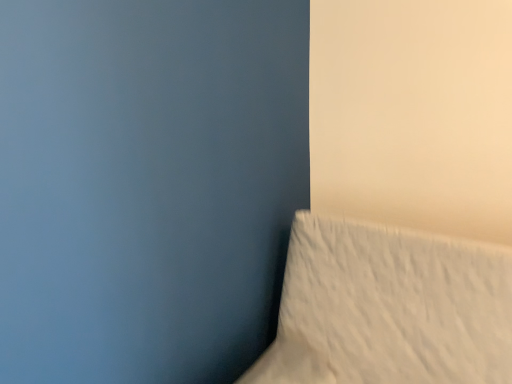
You are a GUI agent. You are given a task and a screenshot of the screen. Output one action in this format:
    pyautogui.click(x=<x>, y=<y>)
    Task: Click on the white textured mattress at lower right
    This screenshot has height=384, width=512.
    Given the screenshot: What is the action you would take?
    pyautogui.click(x=389, y=308)

What do you see at coordinates (389, 308) in the screenshot?
I see `white textured mattress at lower right` at bounding box center [389, 308].

Measure the distance between white textured mattress at lower right and camera.

white textured mattress at lower right is 3.88 feet away from camera.

This screenshot has height=384, width=512. I want to click on white textured mattress at lower right, so click(x=389, y=308).